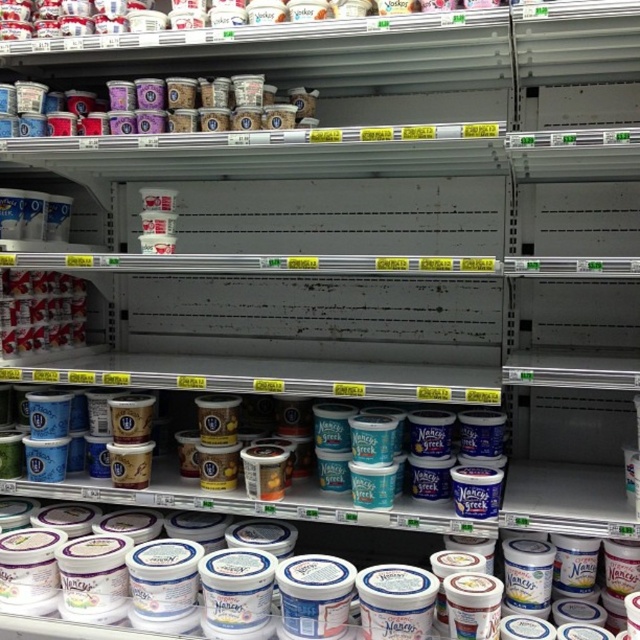
Question: Which object appears farthest from the camera in this image?

Choices:
 (A) metallic silver yogurt at left
 (B) matte plastic yogurt cups at upper center

Answer: (A)

Question: Does matte plastic yogurt cups at upper center appear over metallic silver yogurt at left?

Choices:
 (A) no
 (B) yes

Answer: (B)

Question: Among these points, which one is nearest to the camera?

Choices:
 (A) (72, 291)
 (B) (227, 100)

Answer: (B)

Question: Which point appears closest to the camera in this image?

Choices:
 (A) (12, 353)
 (B) (76, 96)

Answer: (B)

Question: Is the position of matte plastic yogurt cups at upper center less distant than that of metallic silver yogurt at left?

Choices:
 (A) yes
 (B) no

Answer: (A)

Question: Is matte plastic yogurt cups at upper center to the left of metallic silver yogurt at left from the viewer's perspective?

Choices:
 (A) yes
 (B) no

Answer: (B)